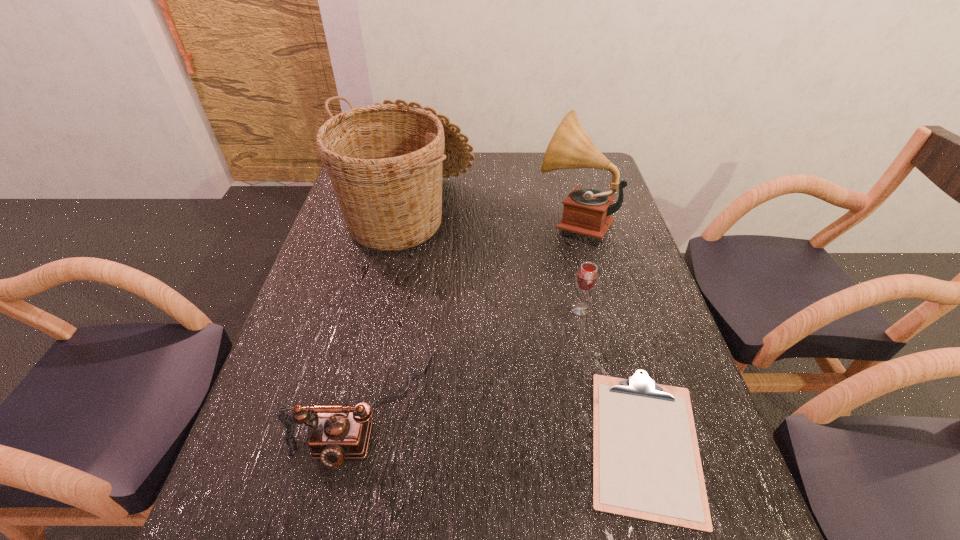
Image resolution: width=960 pixels, height=540 pixels. I want to click on free space between the shortest object and the wineglass, so click(x=612, y=376).

Identify the location of vacant point located between the shortest object and the basket. (526, 329).

Identify the location of free spot between the phonograph record and the third nearest object. Image resolution: width=960 pixels, height=540 pixels. (577, 265).

Where is `the second closest object to the shortest object`? This screenshot has width=960, height=540. the second closest object to the shortest object is located at coordinates (339, 432).

In order to click on object identified as the second closest to the telephone in this screenshot , I will do `click(646, 463)`.

This screenshot has width=960, height=540. What are the coordinates of `free space that satisfies the following two spatial constraints: 1. on the horn of the phonograph record; 2. on the front side of the third farthest object` in the screenshot? It's located at (596, 309).

What are the coordinates of `vacant area that satisfies the following two spatial constraints: 1. on the back side of the shortest object; 2. on the horn of the phonograph record` in the screenshot? It's located at (583, 220).

This screenshot has height=540, width=960. What are the coordinates of `vacant space that satisfies the following two spatial constraints: 1. on the dial of the telephone; 2. on the left side of the clipboard` in the screenshot? It's located at (357, 443).

Find the location of a particular element. The width and height of the screenshot is (960, 540). free region that satisfies the following two spatial constraints: 1. on the horn of the phonograph record; 2. on the dial of the telephone is located at coordinates (621, 406).

Where is `vacant region that satisfies the following two spatial constraints: 1. on the horn of the shortest object; 2. on the left side of the phonograph record`? The image size is (960, 540). vacant region that satisfies the following two spatial constraints: 1. on the horn of the shortest object; 2. on the left side of the phonograph record is located at coordinates (630, 443).